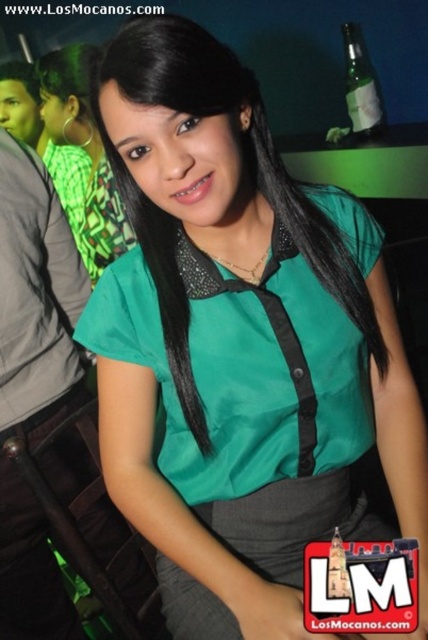
You are a photographer at a social event. You need to capture a photo where the green satin blouse at center is clearly visible without being blocked by the green glass bottle at upper right. Based on their sizes, can you position the camera so the bottle doesn t obscure the blouse?

The green satin blouse at center is much taller than the green glass bottle at upper right, so positioning the camera to focus on the blouse will ensure the bottle doesn t block it since the blouse is larger in height.

You are a photographer at the event and need to capture both the green satin blouse at center and the green glass bottle at upper right in the same frame. Which object should you focus on first to ensure both are in the frame?

You should focus on the green satin blouse at center first because it is larger in size than the green glass bottle at upper right, making it easier to position within the frame while still including the smaller bottle.

You are a photographer trying to capture the woman in the teal blouse at the center of the image. The coordinates provided in the image are given as a point at (85, 150). Can you determine if this point is located on the teal blouse at center?

The point at (85, 150) corresponds to the green satin blouse at center, so yes, the point is located on the teal blouse at center.